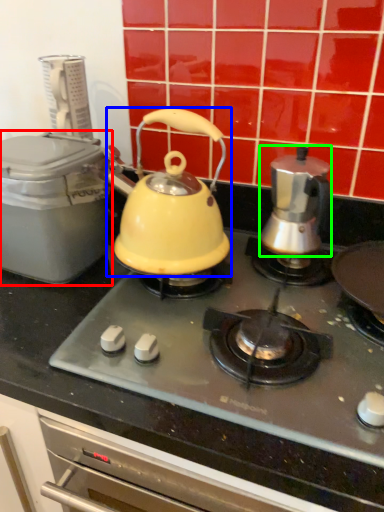
Question: Which object is positioned farthest from kitchen appliance (highlighted by a red box)? Select from kettle (highlighted by a blue box) and kettle (highlighted by a green box).

Choices:
 (A) kettle
 (B) kettle

Answer: (B)